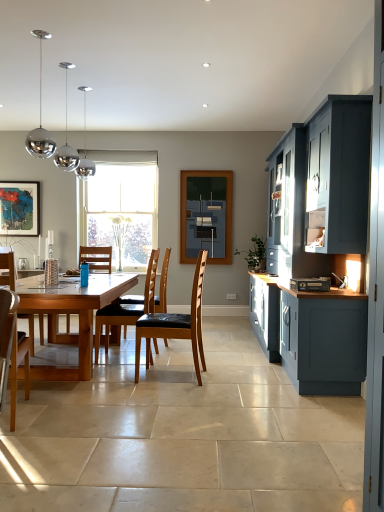
Where is `natural wood table at center`? The height and width of the screenshot is (512, 384). natural wood table at center is located at coordinates 75,313.

What do you see at coordinates (121, 205) in the screenshot? This screenshot has height=512, width=384. I see `clear glass window at center` at bounding box center [121, 205].

Find the location of a particular element. The height and width of the screenshot is (512, 384). matte black picture frame at upper left is located at coordinates (19, 208).

What is the approximate height of matte black picture frame at upper left?

matte black picture frame at upper left is 35.00 inches tall.

Consider the image. In order to face brown leather chair at center, which is counted as the 3th chair, starting from the front, should I rotate leftwards or rightwards?

To face it directly, rotate left by 8.478 degrees.

What do you see at coordinates (6, 335) in the screenshot? I see `wooden chair at left, which appears as the 3th chair when viewed from the right` at bounding box center [6, 335].

Identify the location of matte black painting at center. (206, 215).

From the image's perspective, is wooden chair at left, which appears as the 3th chair when viewed from the right, on black plastic dvd player at right?

Incorrect, from the image's perspective, wooden chair at left, which appears as the 3th chair when viewed from the right, is lower than black plastic dvd player at right.

Based on the photo, is wooden chair at left, positioned as the 1th chair in front-to-back order, inside the boundaries of black plastic dvd player at right, or outside?

wooden chair at left, positioned as the 1th chair in front-to-back order, exists outside the volume of black plastic dvd player at right.

Is wooden chair at left, acting as the 3th chair starting from the back, directly adjacent to black plastic dvd player at right?

No, wooden chair at left, acting as the 3th chair starting from the back, is not touching black plastic dvd player at right.

There is a black plastic dvd player at right. At what (x,y) coordinates should I click in order to perform the action: click on the 2nd chair below it (from a real-world perspective). Please return your answer as a coordinate pair (x, y). This screenshot has width=384, height=512. Looking at the image, I should click on (6, 335).

Considering the relative sizes of matte black painting at center and black plastic dvd player at right in the image provided, is matte black painting at center thinner than black plastic dvd player at right?

Yes, matte black painting at center is thinner than black plastic dvd player at right.

Is matte black painting at center facing towards black plastic dvd player at right?

Yes, matte black painting at center is oriented towards black plastic dvd player at right.

Would you say matte black painting at center is to the left or to the right of black plastic dvd player at right in the picture?

Result: From the image, it's evident that matte black painting at center is to the left of black plastic dvd player at right.

Considering the positions of point (190, 236) and point (330, 285), is point (190, 236) closer or farther from the camera than point (330, 285)?

Point (190, 236) appears to be farther away from the viewer than point (330, 285).

Image resolution: width=384 pixels, height=512 pixels. In order to click on cabinetry on the right of black plastic dvd player at right in this screenshot , I will do `click(321, 243)`.

From the image's perspective, is matte blue cabinet at right below black plastic dvd player at right?

No.

From a real-world perspective, is matte blue cabinet at right physically located above or below black plastic dvd player at right?

matte blue cabinet at right is above black plastic dvd player at right.

In terms of height, does black plastic dvd player at right look taller or shorter compared to matte black picture frame at upper left?

Clearly, black plastic dvd player at right is shorter compared to matte black picture frame at upper left.

From the image's perspective, which is above, black plastic dvd player at right or matte black picture frame at upper left?

matte black picture frame at upper left, from the image's perspective.

What are the coordinates of `appliance above the brown leather chair at center, placed as the second chair when sorted from back to front (from a real-world perspective)` in the screenshot? It's located at (310, 284).

Is brown leather chair at center, the 1th chair viewed from the right, oriented towards black plastic dvd player at right?

No.

Is the surface of brown leather chair at center, marked as the 2th chair in a front-to-back arrangement, in direct contact with black plastic dvd player at right?

brown leather chair at center, marked as the 2th chair in a front-to-back arrangement, is not next to black plastic dvd player at right, and they're not touching.

Choose the correct answer: Is brown leather chair at center, placed as the second chair when sorted from back to front, inside black plastic dvd player at right or outside it?

brown leather chair at center, placed as the second chair when sorted from back to front, is located beyond the bounds of black plastic dvd player at right.

From the image's perspective, is matte black picture frame at upper left below natural wood table at center?

No.

Looking at this image, can you confirm if matte black picture frame at upper left is wider than natural wood table at center?

In fact, matte black picture frame at upper left might be narrower than natural wood table at center.

You are a GUI agent. You are given a task and a screenshot of the screen. Output one action in this format:
    pyautogui.click(x=<x>, y=<y>)
    Task: Click on the kitchen & dining room table in front of the matte black picture frame at upper left
    The width and height of the screenshot is (384, 512).
    Given the screenshot: What is the action you would take?
    75,313

How far apart are matte black picture frame at upper left and natural wood table at center?

matte black picture frame at upper left is 2.53 meters away from natural wood table at center.

Can you confirm if matte black painting at center is positioned to the left of brown leather chair at center, acting as the first chair starting from the back?

Incorrect, matte black painting at center is not on the left side of brown leather chair at center, acting as the first chair starting from the back.

Is matte black painting at center completely or partially outside of brown leather chair at center, which is counted as the 2th chair, starting from the left?

Indeed, matte black painting at center is completely outside brown leather chair at center, which is counted as the 2th chair, starting from the left.

In the scene shown: From a real-world perspective, is matte black painting at center on top of brown leather chair at center, the second chair from the right?

Correct, in the physical world, matte black painting at center is higher than brown leather chair at center, the second chair from the right.

In terms of size, does matte black painting at center appear bigger or smaller than brown leather chair at center, which is counted as the 3th chair, starting from the front?

Considering their sizes, matte black painting at center takes up less space than brown leather chair at center, which is counted as the 3th chair, starting from the front.

Locate an element on the screen. chair that is the 3rd object located below the black plastic dvd player at right (from the image's perspective) is located at coordinates (6, 335).

Locate an element on the screen. The image size is (384, 512). window screen that is above the black plastic dvd player at right (from a real-world perspective) is located at coordinates (206, 215).

When comparing their distances from natural wood table at center, does wooden chair at left, which appears as the 3th chair when viewed from the right, or matte black picture frame at upper left seem further?

matte black picture frame at upper left is further to natural wood table at center.

When comparing their distances from wooden chair at left, which appears as the 3th chair when viewed from the right, does clear glass window at center or matte blue cabinet at right seem closer?

matte blue cabinet at right is positioned closer to the anchor wooden chair at left, which appears as the 3th chair when viewed from the right.

Which object lies nearer to the anchor point clear glass window at center, matte black painting at center or brown leather chair at center?

matte black painting at center lies closer to clear glass window at center than the other object.

Based on their spatial positions, is matte blue cabinet at right or natural wood table at center further from clear glass window at center?

Based on the image, matte blue cabinet at right appears to be further to clear glass window at center.

Looking at the image, which one is located closer to wooden chair at left, which ranks as the 1th chair in left-to-right order, matte blue cabinet at right or brown leather chair at center, which is counted as the 2th chair, starting from the left?

brown leather chair at center, which is counted as the 2th chair, starting from the left, is closer to wooden chair at left, which ranks as the 1th chair in left-to-right order.

From the image, which object appears to be nearer to matte blue cabinet at right, natural wood table at center or black plastic dvd player at right?

The object closer to matte blue cabinet at right is black plastic dvd player at right.

Based on their spatial positions, is matte blue cabinet at right or wooden chair at left, which ranks as the 1th chair in left-to-right order, closer to brown leather chair at center, which is counted as the 3th chair, starting from the front?

matte blue cabinet at right lies closer to brown leather chair at center, which is counted as the 3th chair, starting from the front, than the other object.

When comparing their distances from clear glass window at center, does natural wood table at center or wooden chair at left, positioned as the 1th chair in front-to-back order, seem further?

wooden chair at left, positioned as the 1th chair in front-to-back order, is positioned further to the anchor clear glass window at center.

At what (x,y) coordinates should I click in order to perform the action: click on window screen between matte black picture frame at upper left and black plastic dvd player at right from left to right. Please return your answer as a coordinate pair (x, y). This screenshot has height=512, width=384. Looking at the image, I should click on (206, 215).

The width and height of the screenshot is (384, 512). I want to click on kitchen & dining room table positioned between matte blue cabinet at right and clear glass window at center from near to far, so click(x=75, y=313).

Image resolution: width=384 pixels, height=512 pixels. I want to click on appliance located between brown leather chair at center, marked as the 2th chair in a front-to-back arrangement, and matte blue cabinet at right in the left-right direction, so click(310, 284).

The height and width of the screenshot is (512, 384). In order to click on armchair between natural wood table at center and black plastic dvd player at right in the horizontal direction in this screenshot , I will do `click(163, 285)`.